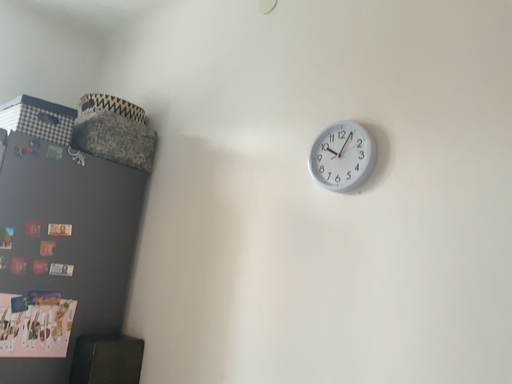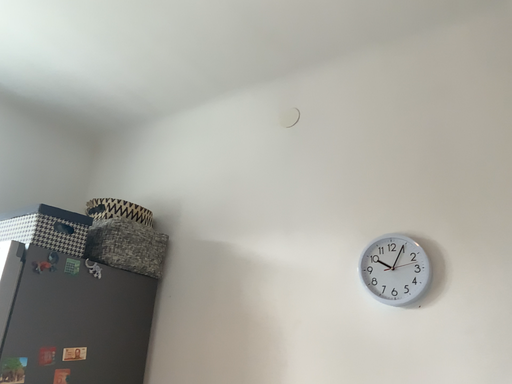
Question: Which way did the camera rotate in the video?

Choices:
 (A) rotated upward
 (B) rotated downward

Answer: (A)